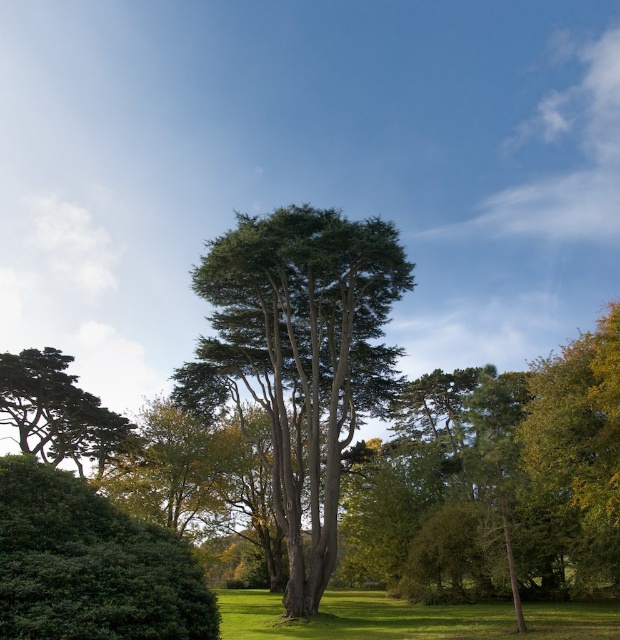
You are planning to plant a new tree in your backyard. You have a space that can accommodate a tree wider than the green leafy hedge at lower left. Based on the image, can the green leafy tree at center fit in your space?

The green leafy tree at center is wider than the green leafy hedge at lower left, so it should fit in your space if it can accommodate a tree wider than the hedge.

You are standing in the center of the image and want to walk towards the point labeled as point (x=301, y=356). What will you encounter first?

You will encounter the green leafy tree at center first because the point (x=301, y=356) corresponds to it.

You are standing in the serene outdoor scene and want to walk towards the two points marked in the image. Which point, point [51,516] or point [392,625], will you reach first?

You will reach point [51,516] first because it is closer to you than point [392,625].